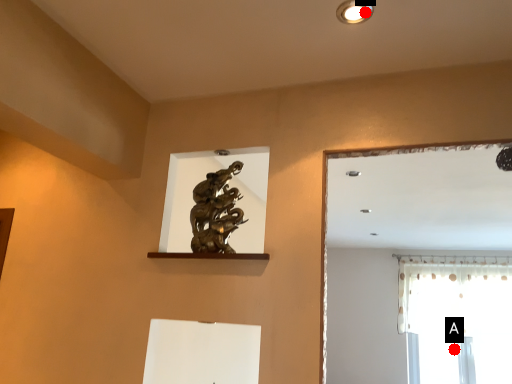
Question: Two points are circled on the image, labeled by A and B beside each circle. Among these points, which one is nearest to the camera?

Choices:
 (A) A is closer
 (B) B is closer

Answer: (B)